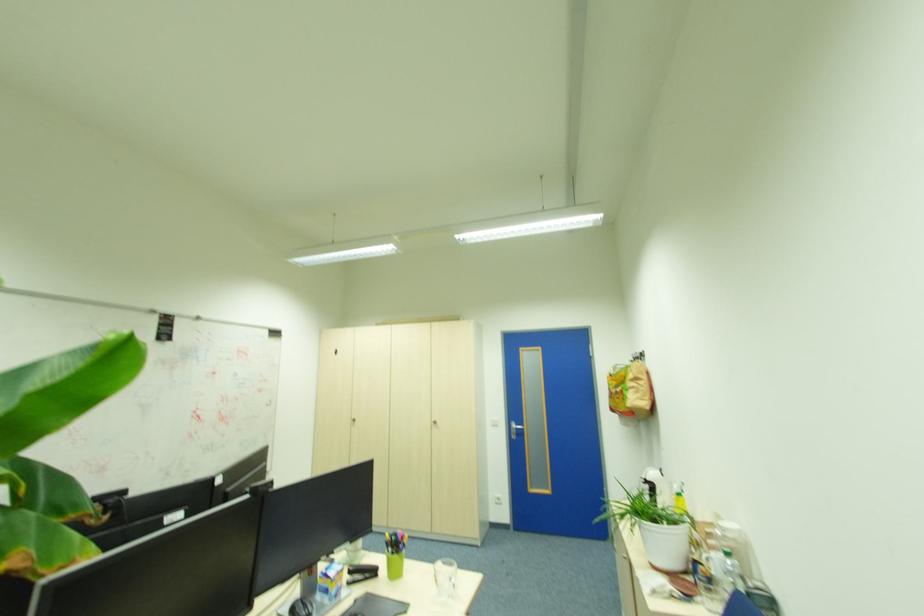
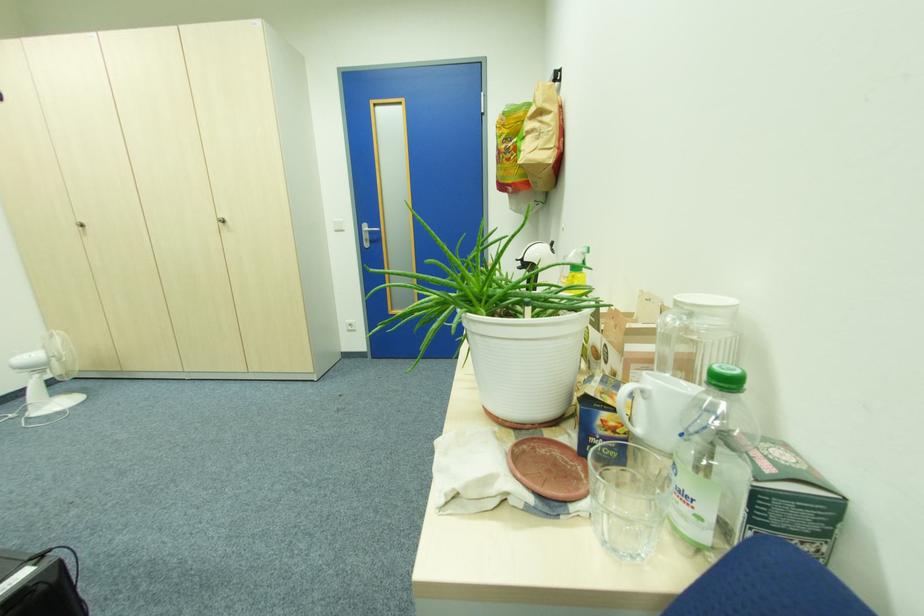
What movement of the cameraman would produce the second image?

The movement direction of the cameraman is right, forward.